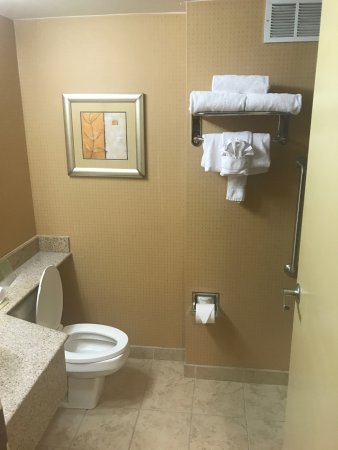
Locate an element on the screen. toilet paper is located at coordinates (212, 318), (197, 319), (205, 298).